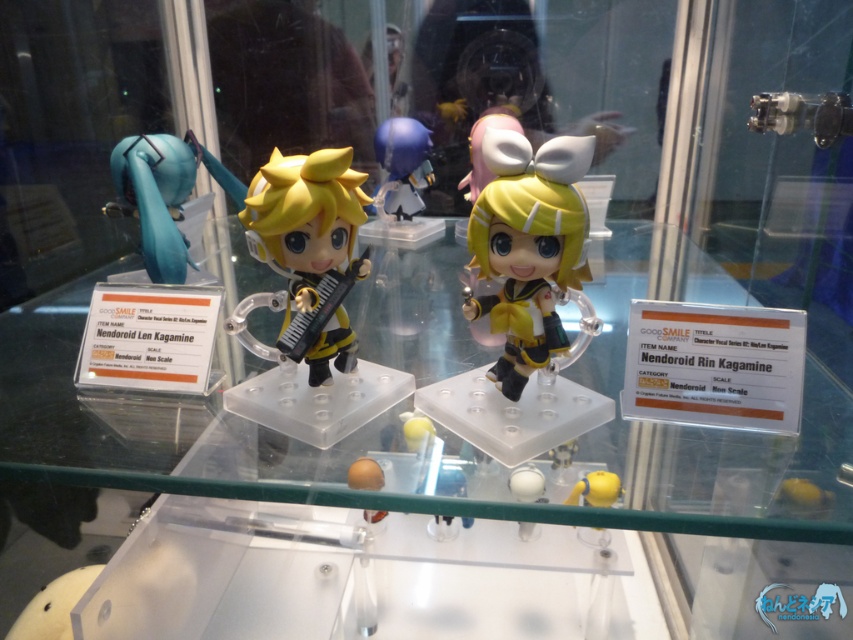
Can you confirm if yellow matte nendoroid at center is smaller than yellow matte figurine at lower center?

Incorrect, yellow matte nendoroid at center is not smaller in size than yellow matte figurine at lower center.

Does yellow matte nendoroid at center have a greater height compared to yellow matte figurine at lower center?

Yes.

Between point (323, 380) and point (604, 538), which one is positioned behind?

The point (604, 538) is more distant.

The height and width of the screenshot is (640, 853). I want to click on yellow matte nendoroid at center, so click(x=305, y=218).

Which is above, yellow matte nendoroid rin kagamine at center or yellow matte figurine at lower center?

yellow matte nendoroid rin kagamine at center is higher up.

Is yellow matte nendoroid rin kagamine at center positioned behind yellow matte figurine at lower center?

Yes, it is behind yellow matte figurine at lower center.

Image resolution: width=853 pixels, height=640 pixels. I want to click on yellow matte nendoroid rin kagamine at center, so click(x=527, y=246).

Who is more distant from viewer, (376, 188) or (605, 496)?

Point (376, 188)

The height and width of the screenshot is (640, 853). Describe the element at coordinates (402, 166) in the screenshot. I see `matte blue figure at center` at that location.

The width and height of the screenshot is (853, 640). I want to click on matte blue figure at center, so click(x=402, y=166).